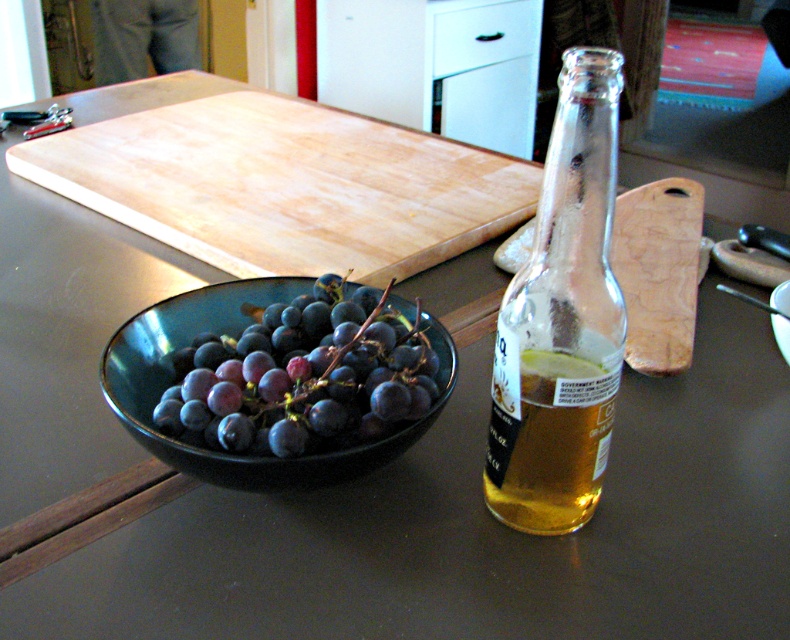
You are a chef preparing a dish and need to access the clear glass bottle at center. However, it is currently blocked by the wooden cutting board at right. Can you reach the bottle without moving the cutting board?

The clear glass bottle at center is positioned under the wooden cutting board at right, so you can reach it by moving your hand underneath the cutting board without needing to move it.

You are arranging items on the kitchen counter and need to place a new spice jar between the clear glass bottle at center and the wooden cutting board at right. Based on their positions, which object should the spice jar be closer to?

The spice jar should be placed closer to the clear glass bottle at center because it is positioned on the left side of the wooden cutting board at right, meaning the bottle is already to the left of the cutting board, so placing the spice jar between them would require it to be near the bottle.

You are organizing items on the kitchen countertop and need to place both the wooden cutting board at center and the wooden cutting board at right. Given their sizes, which one should you place first to maximize space efficiency?

The wooden cutting board at center is larger in size than wooden cutting board at right, so you should place the wooden cutting board at center first to maximize space efficiency.